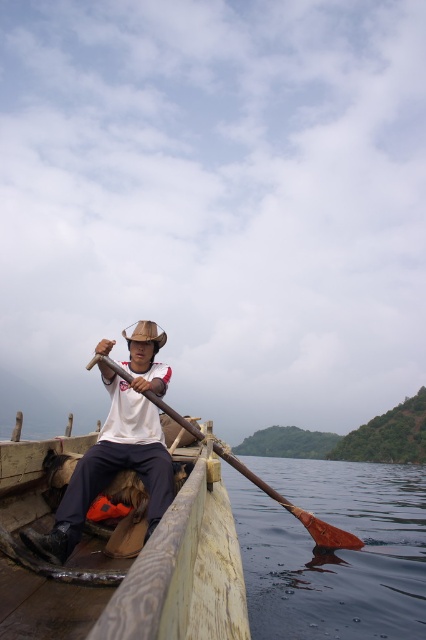
You are navigating a wooden boat and need to retrieve an item that fell into the water near the brown wooden paddle at lower center. Based on its position, which direction should you steer the boat to reach the paddle?

The brown wooden paddle at lower center is located at point [333,552], so you should steer the boat towards the lower center direction to reach it.

You are standing at the origin point in the coordinate system of the image. You see two points, point (331, 508) and point (149, 449). Which point is farther away from you?

Point (331, 508) is behind point (149, 449), so it is farther away from you.

You are standing on the dock and see the wooden canoe at center and the white matte shirt at center. Which object is positioned more to the right side of the scene?

The wooden canoe at center is positioned more to the right side of the scene compared to the white matte shirt at center.